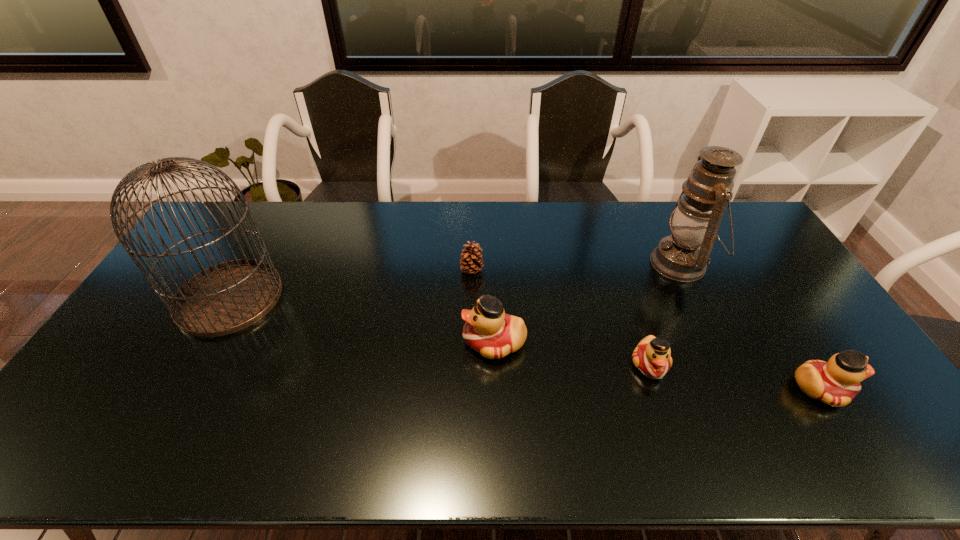
This screenshot has height=540, width=960. Find the location of `the tallest duck`. the tallest duck is located at coordinates (489, 331).

The height and width of the screenshot is (540, 960). I want to click on the leftmost duck, so (x=489, y=331).

Identify the location of the fourth object from left to right. The height and width of the screenshot is (540, 960). (652, 357).

The height and width of the screenshot is (540, 960). In order to click on the shortest duck in this screenshot , I will do `click(652, 357)`.

Find the location of a particular element. Image resolution: width=960 pixels, height=540 pixels. the rightmost duck is located at coordinates (836, 382).

This screenshot has height=540, width=960. Find the location of `the second tallest duck`. the second tallest duck is located at coordinates (836, 382).

Find the location of a particular element. The image size is (960, 540). birdcage is located at coordinates (228, 297).

Find the location of a particular element. The height and width of the screenshot is (540, 960). pinecone is located at coordinates (471, 262).

In order to click on oil lamp in this screenshot , I will do `click(683, 256)`.

Where is `free space located on the face of the leftmost duck`? This screenshot has width=960, height=540. free space located on the face of the leftmost duck is located at coordinates (x=385, y=342).